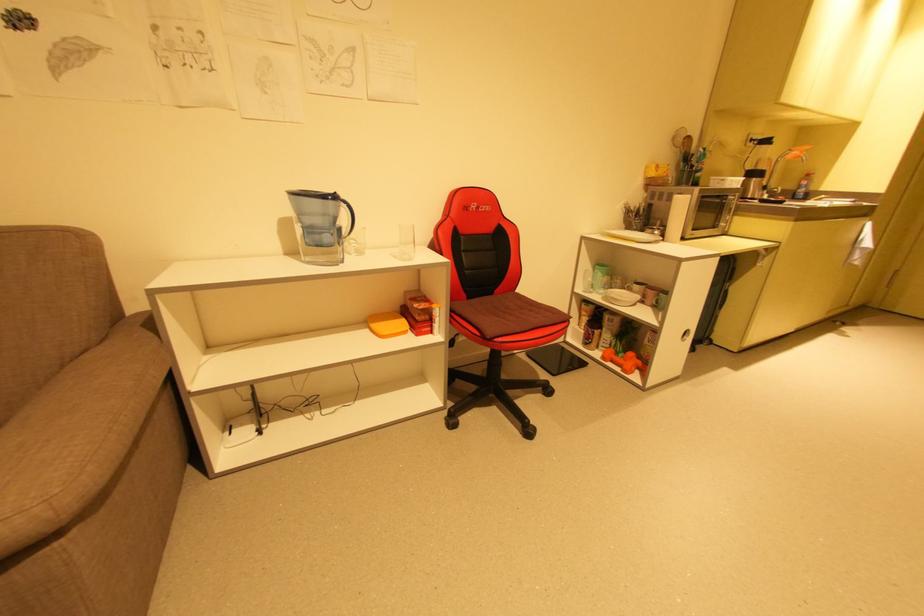
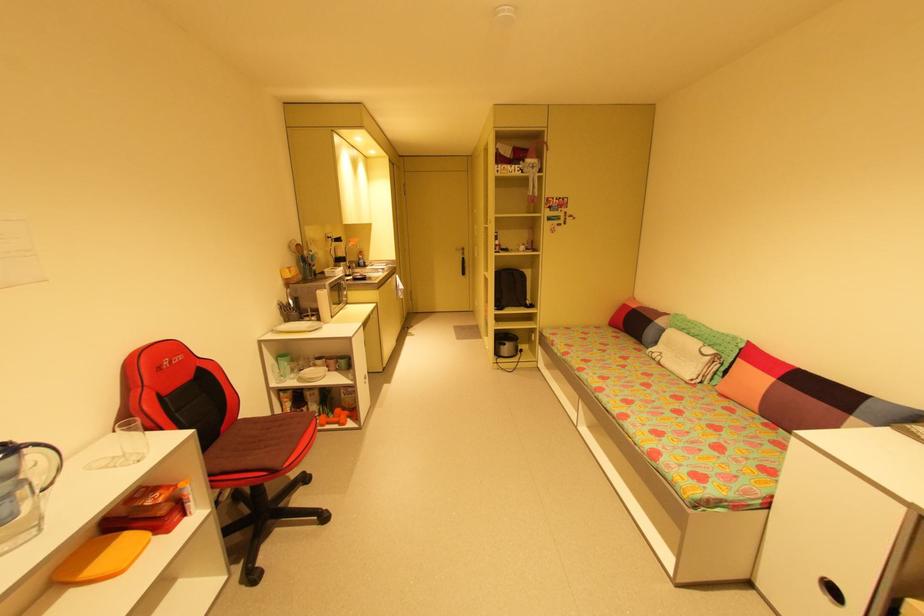
The point at (520, 291) is marked in the first image. Where is the corresponding point in the second image?

(244, 418)